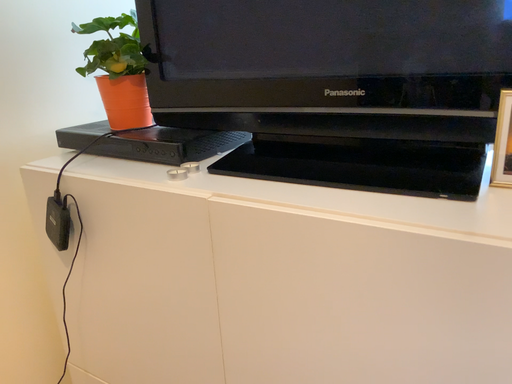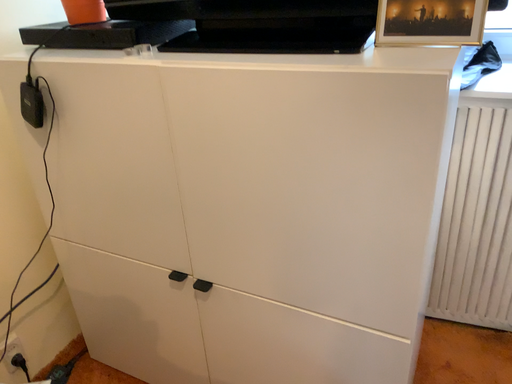
Question: How did the camera likely rotate when shooting the video?

Choices:
 (A) rotated upward
 (B) rotated downward

Answer: (B)